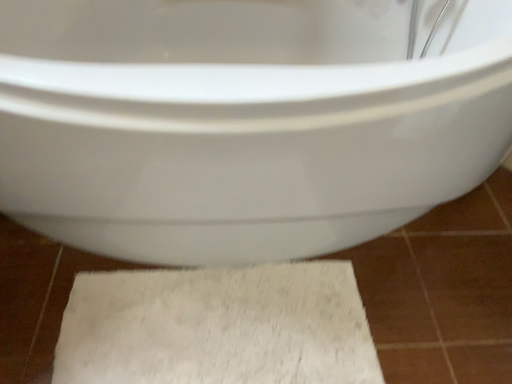
Locate an element on the screen. This screenshot has height=384, width=512. vacant region above white fluffy bath mat at lower center (from a real-world perspective) is located at coordinates (190, 336).